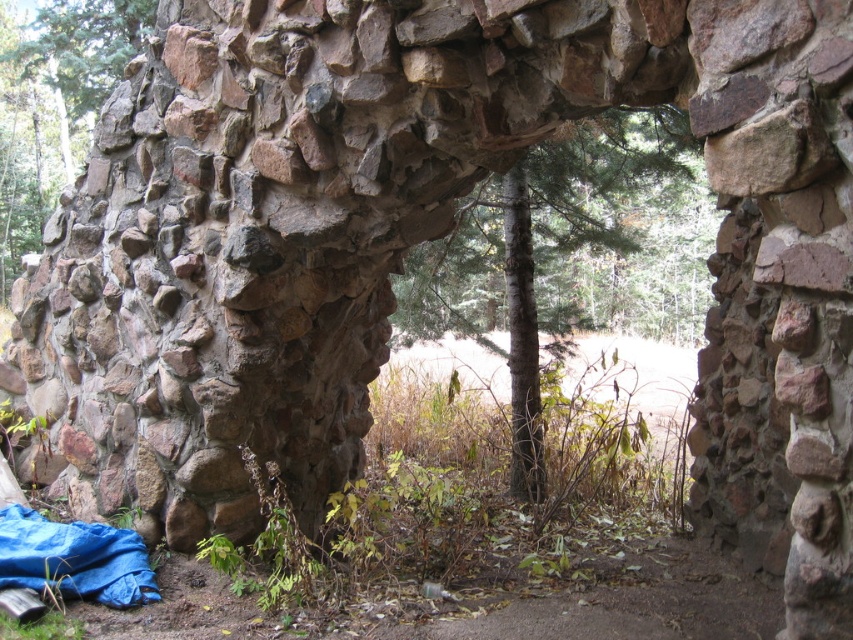
Question: Which point is farther to the camera?

Choices:
 (A) (398, 292)
 (B) (9, 259)

Answer: (B)

Question: Does green textured tree at center have a larger size compared to rustic stone wall at center?

Choices:
 (A) yes
 (B) no

Answer: (A)

Question: Which point is closer to the camera?

Choices:
 (A) green textured tree at center
 (B) rustic stone wall at center

Answer: (A)

Question: Does green textured tree at center appear on the right side of rustic stone wall at center?

Choices:
 (A) yes
 (B) no

Answer: (A)

Question: Can you confirm if green textured tree at center is positioned above rustic stone wall at center?

Choices:
 (A) yes
 (B) no

Answer: (B)